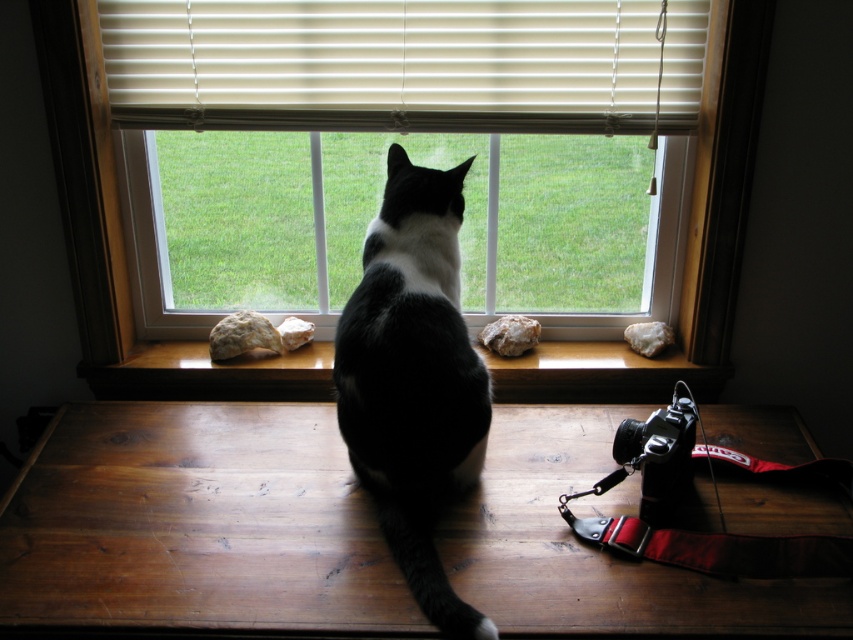
You are standing in the room and want to adjust the white matte blinds at upper center to let in more light. Based on their current position, which direction should you move them?

The white matte blinds at upper center are positioned at coordinates approximately 0.102 on the x and 0.476 on the y axis. To allow more light, you should move them upward to increase the gap between the slats, letting in more natural light.

You are a person standing in the room and want to look outside through the transparent glass window at center. Is there any object blocking your view of the wooden at center through the window?

The transparent glass window at center is in front of the wooden at center, so the window itself does not block the view of the wooden at center. You can see the wooden at center through the window.